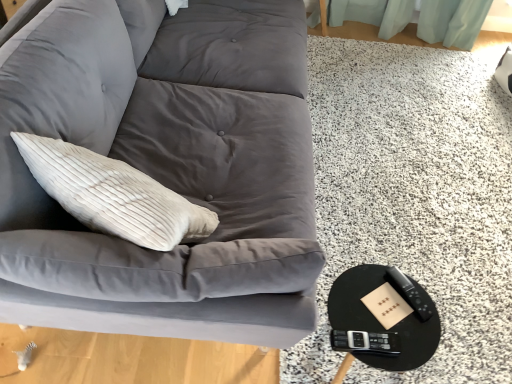
Question: From the image's perspective, would you say black glossy round table at lower right is shown under matte gray fabric couch at upper left?

Choices:
 (A) no
 (B) yes

Answer: (B)

Question: Is black glossy round table at lower right further to the viewer compared to matte gray fabric couch at upper left?

Choices:
 (A) yes
 (B) no

Answer: (A)

Question: From a real-world perspective, is black glossy round table at lower right over matte gray fabric couch at upper left?

Choices:
 (A) no
 (B) yes

Answer: (A)

Question: Is black glossy round table at lower right to the left of matte gray fabric couch at upper left from the viewer's perspective?

Choices:
 (A) yes
 (B) no

Answer: (B)

Question: Would you say matte gray fabric couch at upper left is part of black glossy round table at lower right's contents?

Choices:
 (A) yes
 (B) no

Answer: (B)

Question: Would you say black plastic remote at lower right is to the left or to the right of black glossy round table at lower right in the picture?

Choices:
 (A) right
 (B) left

Answer: (A)

Question: Considering the positions of black plastic remote at lower right and black glossy round table at lower right in the image, is black plastic remote at lower right wider or thinner than black glossy round table at lower right?

Choices:
 (A) thin
 (B) wide

Answer: (A)

Question: Is point (401, 278) positioned closer to the camera than point (371, 352)?

Choices:
 (A) closer
 (B) farther

Answer: (B)

Question: From the image's perspective, is black plastic remote at lower right located above or below black glossy round table at lower right?

Choices:
 (A) below
 (B) above

Answer: (B)

Question: Is matte gray fabric couch at upper left taller or shorter than black glossy round table at lower right?

Choices:
 (A) short
 (B) tall

Answer: (B)

Question: From the image's perspective, is matte gray fabric couch at upper left above or below black glossy round table at lower right?

Choices:
 (A) above
 (B) below

Answer: (A)

Question: Is matte gray fabric couch at upper left wider or thinner than black glossy round table at lower right?

Choices:
 (A) wide
 (B) thin

Answer: (B)

Question: Would you say matte gray fabric couch at upper left is to the left or to the right of black glossy round table at lower right in the picture?

Choices:
 (A) left
 (B) right

Answer: (A)

Question: Considering the positions of black glossy round table at lower right and black plastic remote at lower right in the image, is black glossy round table at lower right wider or thinner than black plastic remote at lower right?

Choices:
 (A) wide
 (B) thin

Answer: (A)

Question: Considering the positions of black glossy round table at lower right and black plastic remote at lower right in the image, is black glossy round table at lower right taller or shorter than black plastic remote at lower right?

Choices:
 (A) short
 (B) tall

Answer: (B)